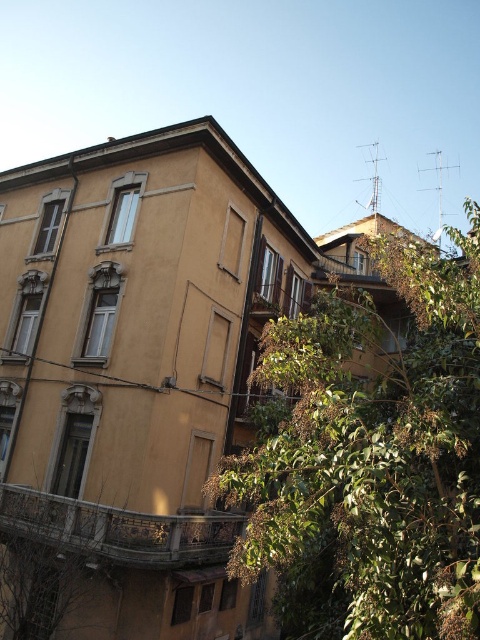
Is green leafy tree at center positioned at the back of stone textured balcony at lower left?

No, it is not.

Is green leafy tree at center positioned in front of stone textured balcony at lower left?

Yes, green leafy tree at center is in front of stone textured balcony at lower left.

Locate an element on the screen. This screenshot has height=640, width=480. green leafy tree at center is located at coordinates (371, 461).

You are a GUI agent. You are given a task and a screenshot of the screen. Output one action in this format:
    pyautogui.click(x=<x>, y=<y>)
    Task: Click on the green leafy tree at center
    This screenshot has width=480, height=640.
    Given the screenshot: What is the action you would take?
    pyautogui.click(x=371, y=461)